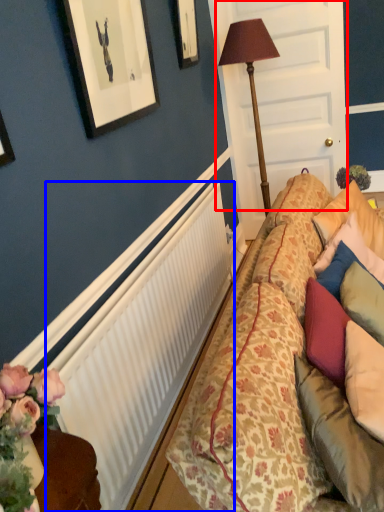
Question: Which object is further to the camera taking this photo, door (highlighted by a red box) or radiator (highlighted by a blue box)?

Choices:
 (A) door
 (B) radiator

Answer: (A)